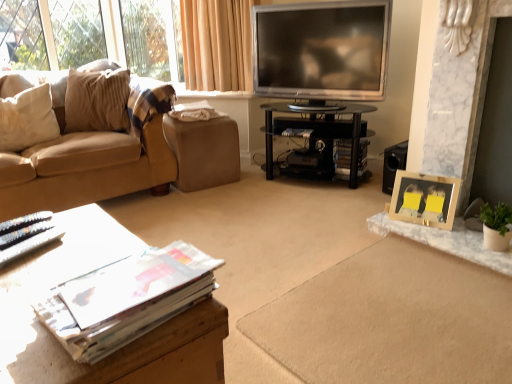
You are a GUI agent. You are given a task and a screenshot of the screen. Output one action in this format:
    pyautogui.click(x=<x>, y=<y>)
    Task: Click on the empty space that is ontop of wooden table at lower left, which is the 1th table from front to back (from a real-world perspective)
    
    Given the screenshot: What is the action you would take?
    pyautogui.click(x=68, y=253)